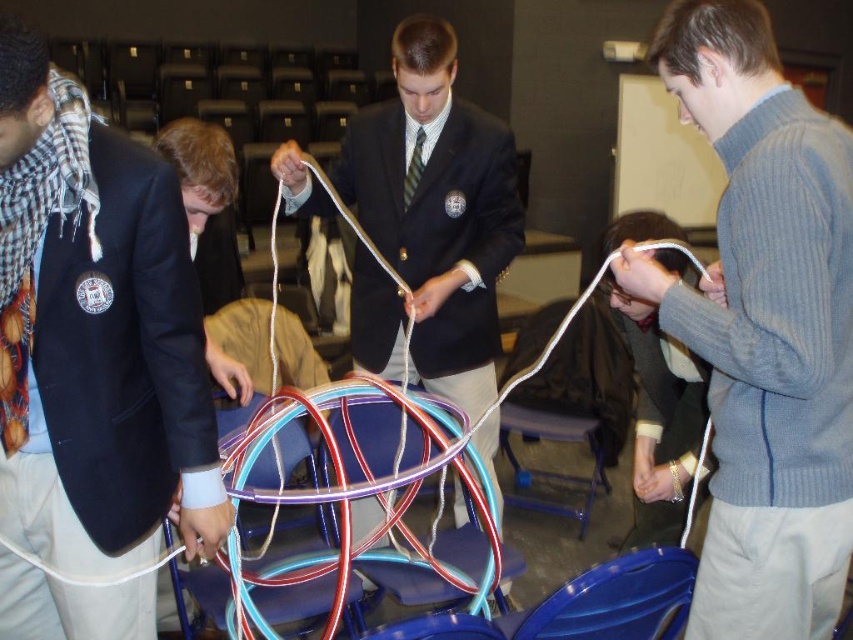
Who is more forward, (828, 464) or (639, 369)?

Point (828, 464) is in front.

Does gray wool sweater at center have a greater width compared to white matte cord at lower right?

Correct, the width of gray wool sweater at center exceeds that of white matte cord at lower right.

Does point (773, 202) come in front of point (640, 236)?

Yes, it is in front of point (640, 236).

This screenshot has width=853, height=640. In order to click on gray wool sweater at center in this screenshot , I will do `click(764, 326)`.

From the picture: Is the position of matte black suit at center less distant than that of gold metallic bracelet at upper center?

No.

Between matte black suit at center and gold metallic bracelet at upper center, which one has more height?

Standing taller between the two is matte black suit at center.

Who is more forward, (456,248) or (679,497)?

Positioned in front is point (679,497).

Identify the location of matte black suit at center. tap(430, 221).

The width and height of the screenshot is (853, 640). What do you see at coordinates (659, 417) in the screenshot?
I see `white matte cord at lower right` at bounding box center [659, 417].

Is white matte cord at lower right further to camera compared to translucent rubber band at lower center?

That is False.

This screenshot has width=853, height=640. In order to click on white matte cord at lower right in this screenshot , I will do (659, 417).

I want to click on white matte cord at lower right, so click(659, 417).